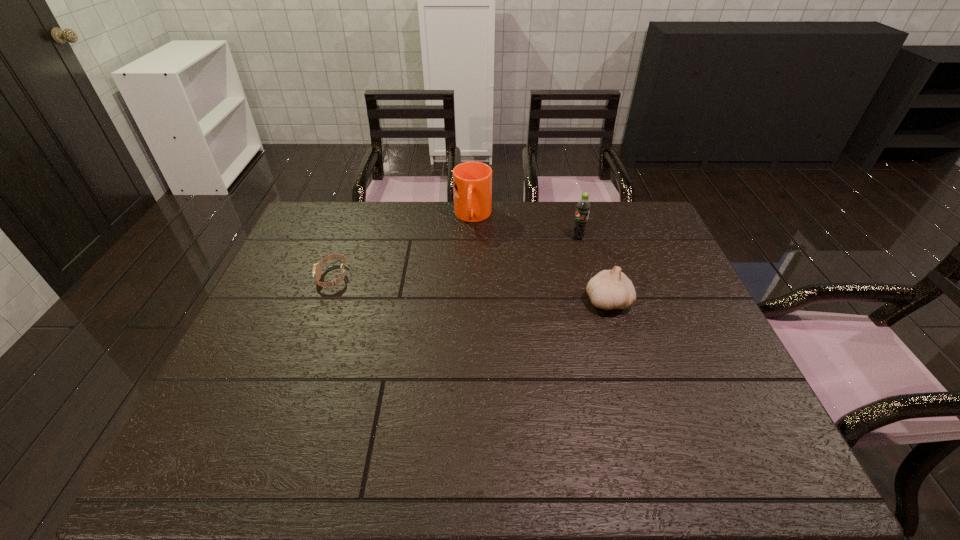
The height and width of the screenshot is (540, 960). What are the coordinates of `vacant space on the desktop that is between the shortest object and the second shortest object and is positioned on the front label of the soda` in the screenshot? It's located at (446, 287).

What are the coordinates of `vacant space on the desktop that is between the shortest object and the garlic and is positioned on the handle side of the farthest object` in the screenshot? It's located at (468, 288).